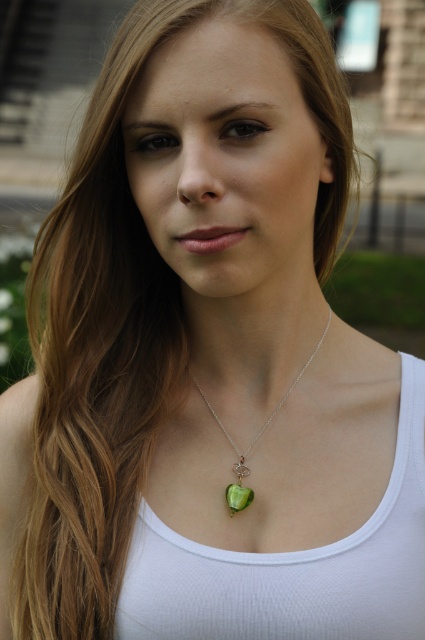
Question: Among these objects, which one is farthest from the camera?

Choices:
 (A) green glass pendant at center
 (B) green gemstone pendant at center

Answer: (B)

Question: Among these objects, which one is nearest to the camera?

Choices:
 (A) green gemstone pendant at center
 (B) green glass pendant at center

Answer: (B)

Question: Is green glass pendant at center closer to the viewer compared to green gemstone pendant at center?

Choices:
 (A) no
 (B) yes

Answer: (B)

Question: Does green glass pendant at center come in front of green gemstone pendant at center?

Choices:
 (A) yes
 (B) no

Answer: (A)

Question: Does green glass pendant at center appear on the left side of green gemstone pendant at center?

Choices:
 (A) no
 (B) yes

Answer: (A)

Question: Which of the following is the farthest from the observer?

Choices:
 (A) green glass pendant at center
 (B) green gemstone pendant at center

Answer: (B)